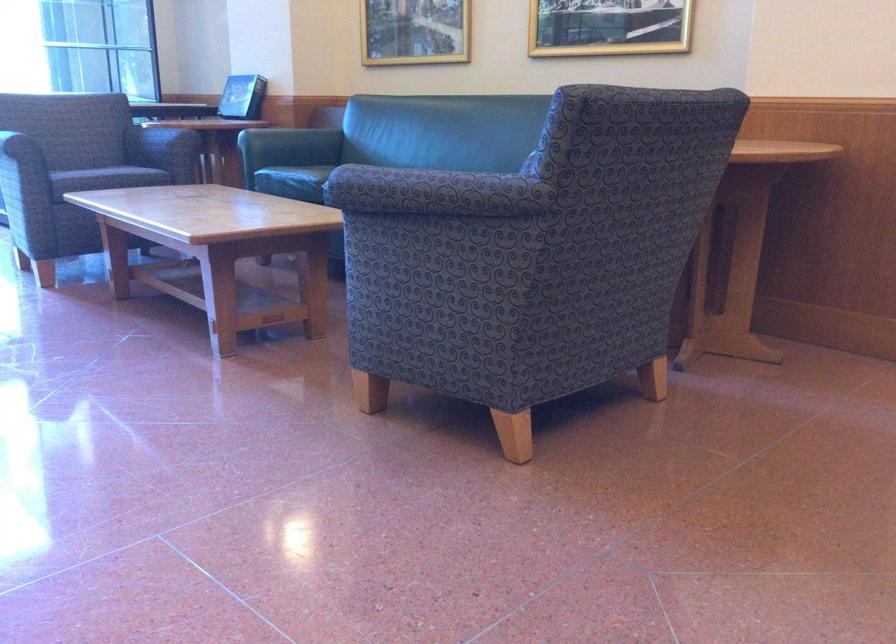
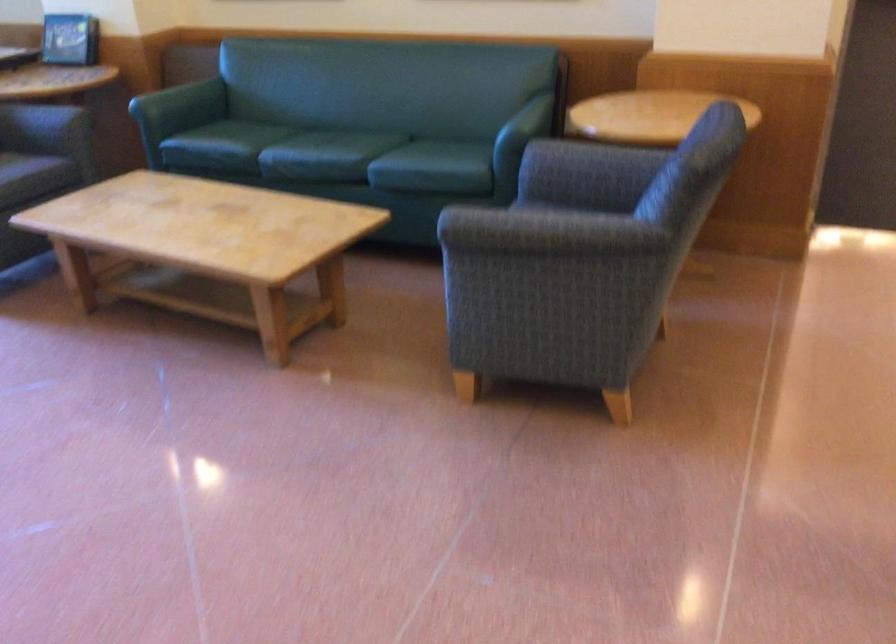
Question: The images are taken continuously from a first-person perspective. In which direction are you moving?

Choices:
 (A) Left
 (B) Right
 (C) Forward
 (D) Backward

Answer: (A)